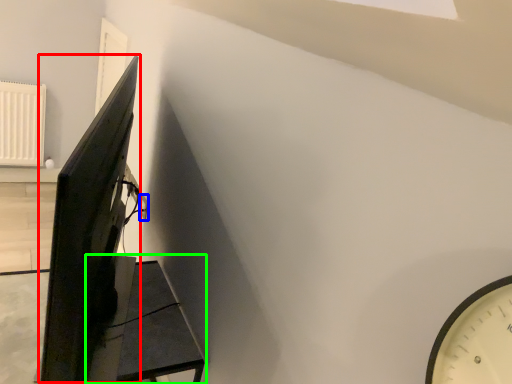
Question: Which object is the farthest from computer monitor (highlighted by a red box)? Choose among these: electric outlet (highlighted by a blue box) or furniture (highlighted by a green box).

Choices:
 (A) electric outlet
 (B) furniture

Answer: (A)